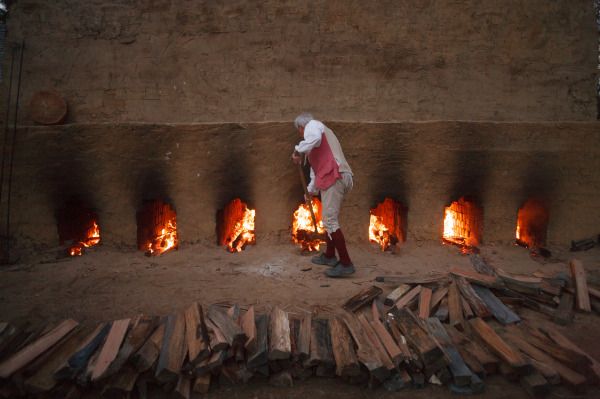
You are a GUI agent. You are given a task and a screenshot of the screen. Output one action in this format:
    pyautogui.click(x=<x>, y=<y>)
    Task: Click on the wall
    The width and height of the screenshot is (600, 399).
    Given the screenshot: What is the action you would take?
    pyautogui.click(x=316, y=80)